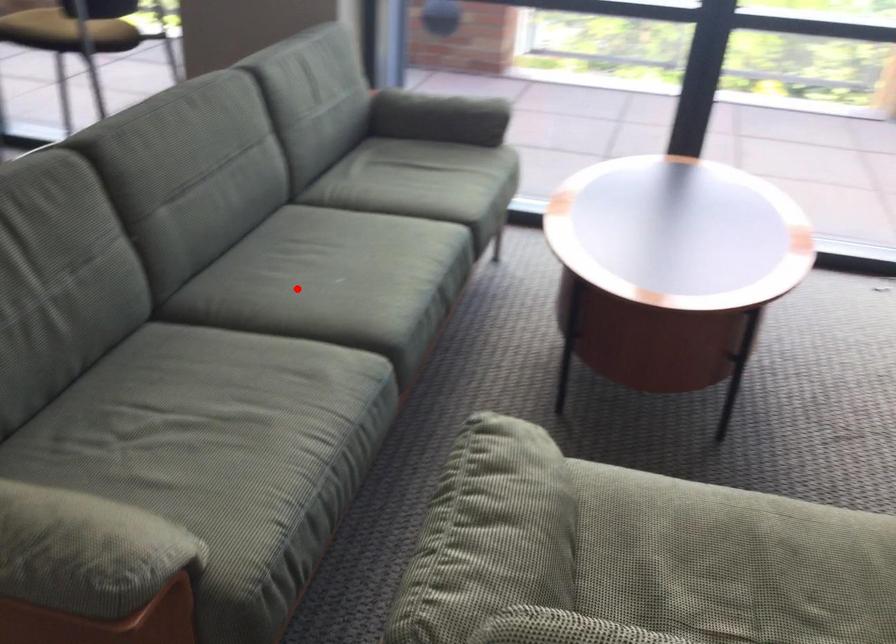
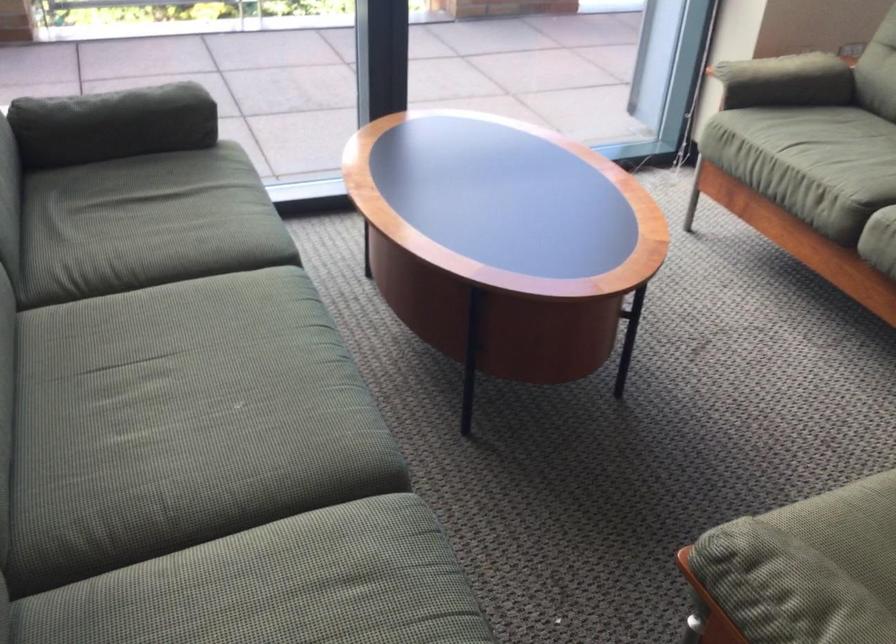
Question: I am providing you with two images of the same scene from different viewpoints. In image1, a red point is highlighted. Considering the same 3D point in image2, which of the following is correct?

Choices:
 (A) It is closer
 (B) It is farther

Answer: (A)